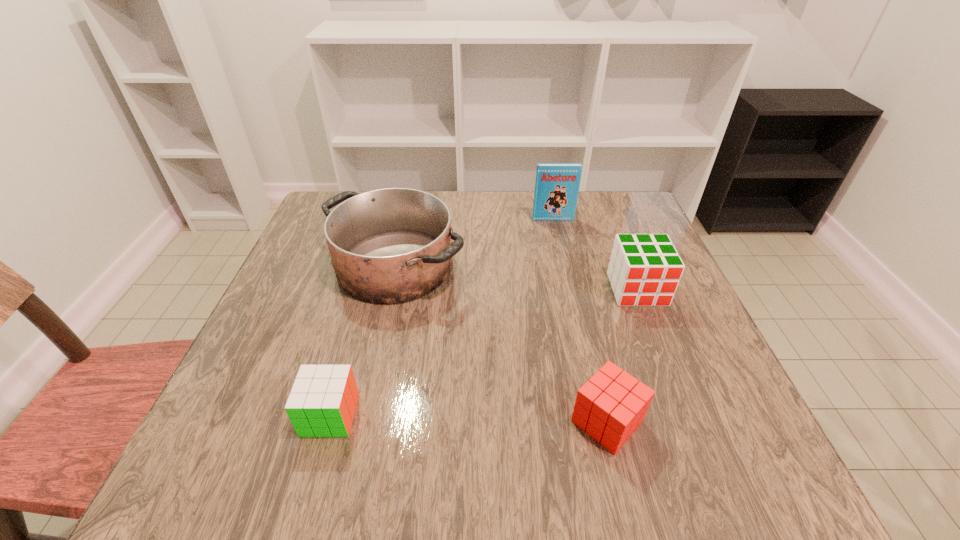
This screenshot has height=540, width=960. Identify the location of free space located on the back of the second cube from right to left. (593, 364).

At what (x,y) coordinates should I click in order to perform the action: click on vacant space situated on the right of the leftmost cube. Please return your answer as a coordinate pair (x, y). Looking at the image, I should click on (505, 415).

Locate an element on the screen. The width and height of the screenshot is (960, 540). book located in the far edge section of the desktop is located at coordinates (557, 185).

The image size is (960, 540). What are the coordinates of `saucepan present at the far edge` in the screenshot? It's located at (392, 245).

Locate an element on the screen. The image size is (960, 540). saucepan that is at the left edge is located at coordinates (392, 245).

Identify the location of cube that is at the left edge. (322, 403).

Locate an element on the screen. This screenshot has height=540, width=960. object located in the right edge section of the desktop is located at coordinates (644, 270).

Find the location of a particular element. object present at the far left corner is located at coordinates (392, 245).

At what (x,y) coordinates should I click in order to perform the action: click on object that is at the near left corner. Please return your answer as a coordinate pair (x, y). The width and height of the screenshot is (960, 540). Looking at the image, I should click on (322, 403).

At what (x,y) coordinates should I click in order to perform the action: click on vacant space at the far edge of the desktop. Please return your answer as a coordinate pair (x, y). Looking at the image, I should click on (492, 234).